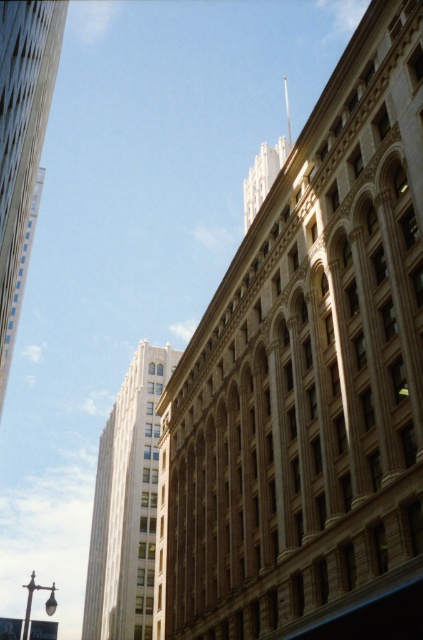
Question: Considering the relative positions of brown stone building at center and white marble tower at upper left in the image provided, where is brown stone building at center located with respect to white marble tower at upper left?

Choices:
 (A) below
 (B) above

Answer: (B)

Question: Which point is farther to the camera?

Choices:
 (A) (126, 563)
 (B) (362, 317)

Answer: (A)

Question: Does brown stone building at center have a smaller size compared to white marble tower at upper left?

Choices:
 (A) no
 (B) yes

Answer: (B)

Question: Does brown stone building at center have a larger size compared to white marble tower at upper left?

Choices:
 (A) yes
 (B) no

Answer: (B)

Question: Which object is farther from the camera taking this photo?

Choices:
 (A) white marble tower at upper left
 (B) brown stone building at center

Answer: (A)